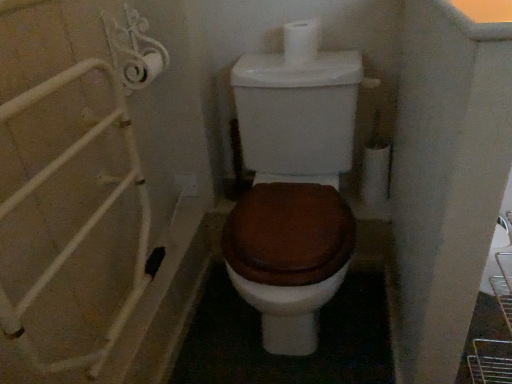
Question: From the image's perspective, is brown matte toilet at center above white matte toilet paper at upper center?

Choices:
 (A) yes
 (B) no

Answer: (B)

Question: Is brown matte toilet at center to the right of white matte toilet paper at upper center from the viewer's perspective?

Choices:
 (A) no
 (B) yes

Answer: (A)

Question: Is brown matte toilet at center taller than white matte toilet paper at upper center?

Choices:
 (A) yes
 (B) no

Answer: (A)

Question: Considering the relative positions of brown matte toilet at center and white matte toilet paper at upper center in the image provided, is brown matte toilet at center in front of white matte toilet paper at upper center?

Choices:
 (A) yes
 (B) no

Answer: (A)

Question: Does brown matte toilet at center have a lesser height compared to white matte toilet paper at upper center?

Choices:
 (A) yes
 (B) no

Answer: (B)

Question: Is brown matte toilet at center positioned far away from white matte toilet paper at upper center?

Choices:
 (A) no
 (B) yes

Answer: (A)

Question: Considering the relative sizes of white matte toilet paper at upper center and brown matte toilet at center in the image provided, is white matte toilet paper at upper center bigger than brown matte toilet at center?

Choices:
 (A) no
 (B) yes

Answer: (A)

Question: Is white matte toilet paper at upper center next to brown matte toilet at center?

Choices:
 (A) no
 (B) yes

Answer: (A)

Question: Would you say white matte toilet paper at upper center contains brown matte toilet at center?

Choices:
 (A) yes
 (B) no

Answer: (B)

Question: Does white matte toilet paper at upper center have a greater width compared to brown matte toilet at center?

Choices:
 (A) yes
 (B) no

Answer: (B)

Question: Is white matte toilet paper at upper center outside brown matte toilet at center?

Choices:
 (A) yes
 (B) no

Answer: (A)

Question: Does white matte toilet paper at upper center have a lesser width compared to brown matte toilet at center?

Choices:
 (A) yes
 (B) no

Answer: (A)

Question: Looking at the image, does brown matte toilet at center seem bigger or smaller compared to white matte toilet paper at upper center?

Choices:
 (A) big
 (B) small

Answer: (A)